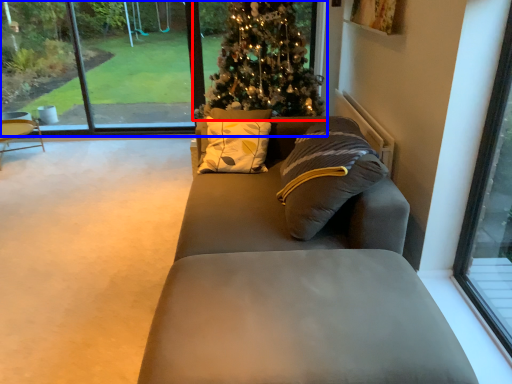
Question: Which of the following is the farthest to the observer, christmas tree (highlighted by a red box) or window (highlighted by a blue box)?

Choices:
 (A) christmas tree
 (B) window

Answer: (B)